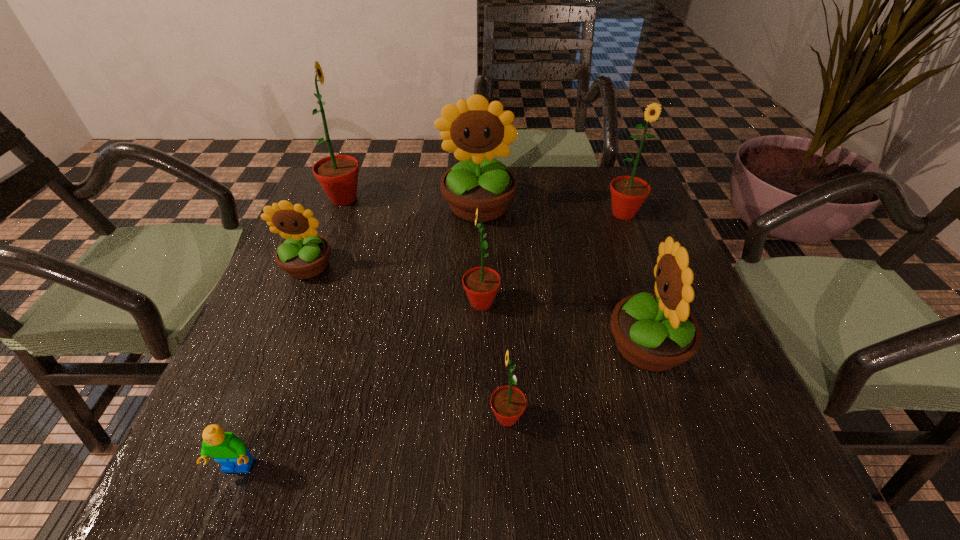
What are the coordinates of `blank space located on the face of the second nearest green sunflower` in the screenshot? It's located at (430, 302).

You are a GUI agent. You are given a task and a screenshot of the screen. Output one action in this format:
    pyautogui.click(x=<x>, y=<y>)
    Task: Click on the vacant space located on the face of the second nearest green sunflower
    
    Given the screenshot: What is the action you would take?
    tap(353, 302)

Identify the location of vacant space located on the face of the second nearest green sunflower. This screenshot has width=960, height=540. (439, 302).

Image resolution: width=960 pixels, height=540 pixels. In order to click on free space located on the face of the second nearest yellow sunflower in this screenshot , I will do `click(265, 369)`.

Identify the location of free location located 0.210m on the face of the second nearest object. This screenshot has width=960, height=540. (x=365, y=417).

Locate an element on the screen. Image resolution: width=960 pixels, height=540 pixels. vacant area situated on the face of the second nearest object is located at coordinates (430, 417).

This screenshot has height=540, width=960. In order to click on free space located 0.290m on the face of the second nearest object in this screenshot , I will do click(317, 417).

Image resolution: width=960 pixels, height=540 pixels. I want to click on sunflower located at the near edge, so click(508, 403).

Locate an element on the screen. The image size is (960, 540). Lego positioned at the near edge is located at coordinates (x=226, y=448).

The width and height of the screenshot is (960, 540). I want to click on Lego present at the left edge, so click(x=226, y=448).